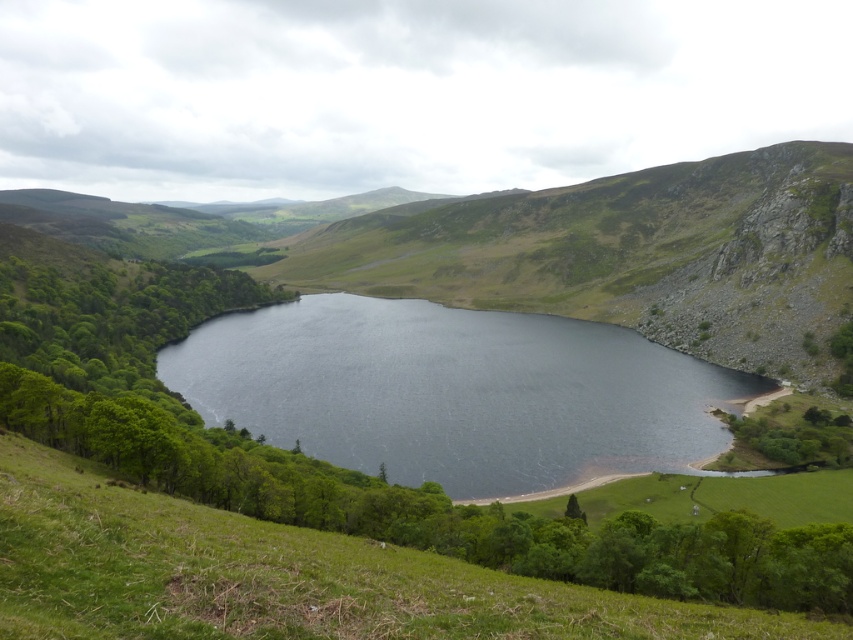
You are standing at the edge of the green grassy hillside at lower center and want to reach the dark blue water at center. Which direction should you move to get there?

You should move upward towards the dark blue water at center since it is located above the green grassy hillside at lower center.

You are standing at the edge of the dark blue water at center and want to reach the green grassy hillside at lower center. Which direction should you walk to get there?

The dark blue water at center is positioned on the right side of green grassy hillside at lower center, so you should walk to the left to reach the green grassy hillside at lower center.